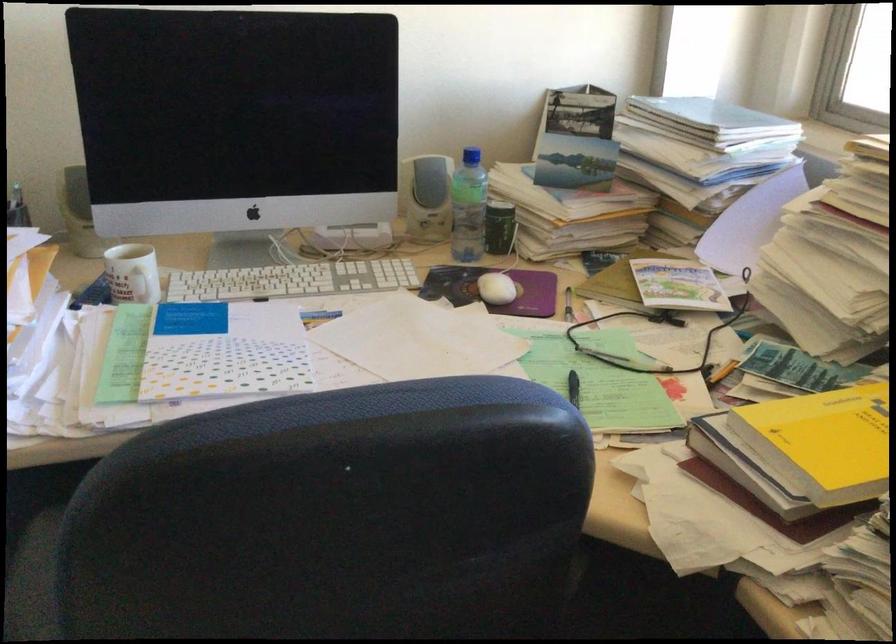
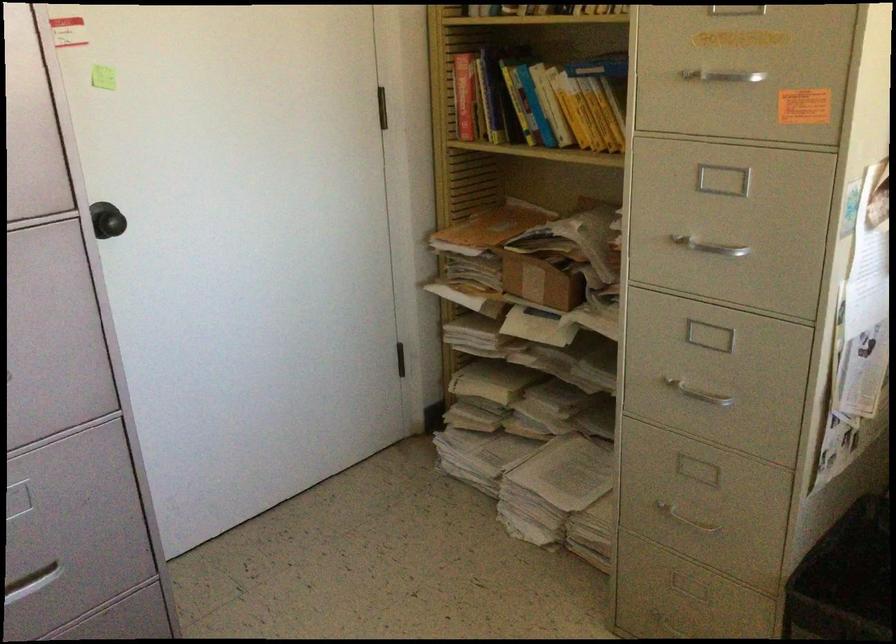
Question: How did the camera likely rotate?

Choices:
 (A) Left
 (B) Right
 (C) Up
 (D) Down

Answer: (A)